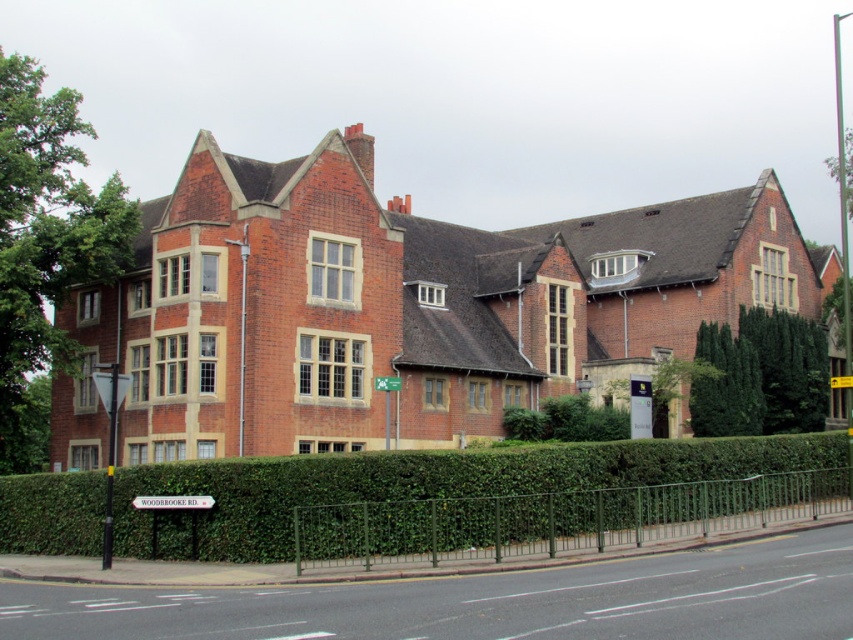
Question: Estimate the real-world distances between objects in this image. Which object is closer to the green plastic sign at center?

Choices:
 (A) green leafy hedge at lower center
 (B) dark green leafy hedge at right

Answer: (A)

Question: Among these points, which one is farthest from the camera?

Choices:
 (A) (392, 378)
 (B) (785, 326)
 (C) (842, 460)

Answer: (B)

Question: Which object is positioned closest to the green plastic sign at center?

Choices:
 (A) dark green leafy hedge at right
 (B) green leafy hedge at lower center

Answer: (B)

Question: In this image, where is green leafy hedge at lower center located relative to dark green leafy hedge at right?

Choices:
 (A) right
 (B) left

Answer: (B)

Question: Can you confirm if green leafy hedge at lower center is positioned to the right of dark green leafy hedge at right?

Choices:
 (A) no
 (B) yes

Answer: (A)

Question: Can you confirm if dark green leafy hedge at right is positioned above green plastic sign at center?

Choices:
 (A) no
 (B) yes

Answer: (A)